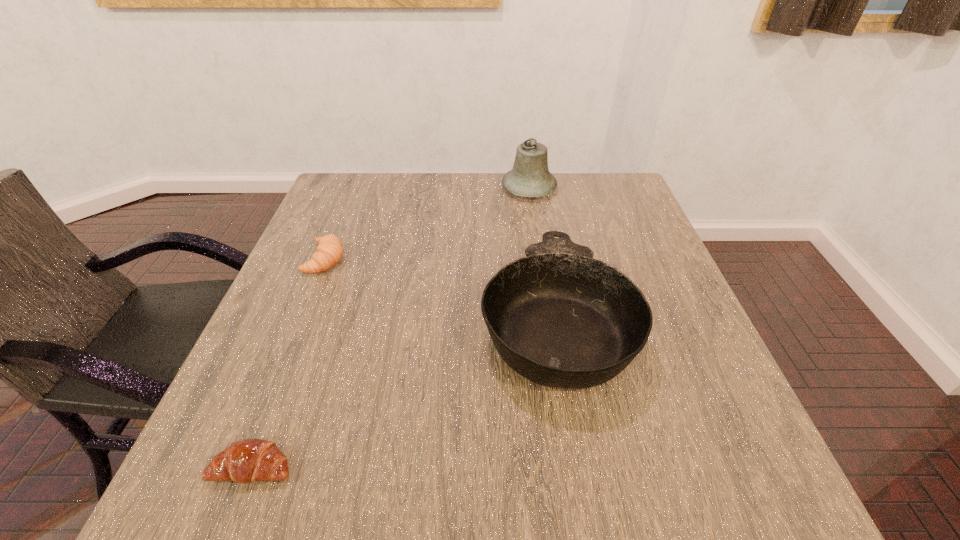
Where is `the second closest object to the bell`? The width and height of the screenshot is (960, 540). the second closest object to the bell is located at coordinates (329, 251).

The image size is (960, 540). What are the coordinates of `blank space that satisfies the following two spatial constraints: 1. on the back side of the farther crescent roll; 2. on the right side of the farthest object` in the screenshot? It's located at (354, 188).